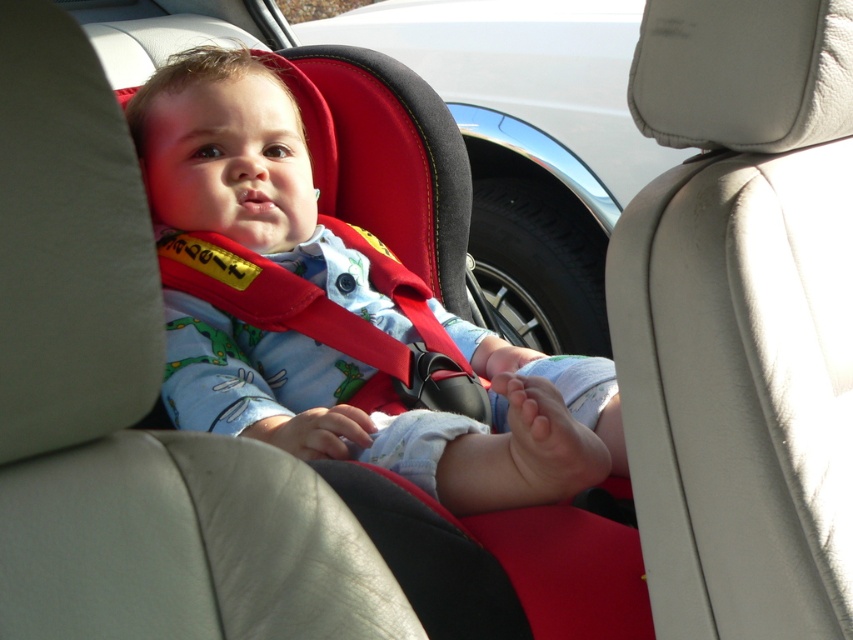
Question: Does matte red car seat at center have a greater width compared to matte black car seat at upper center?

Choices:
 (A) yes
 (B) no

Answer: (B)

Question: Can you confirm if matte red car seat at center is positioned below matte black car seat at upper center?

Choices:
 (A) yes
 (B) no

Answer: (A)

Question: Which object is closer to the camera taking this photo?

Choices:
 (A) matte black car seat at upper center
 (B) matte red car seat at center

Answer: (B)

Question: Is matte red car seat at center to the right of matte black car seat at upper center from the viewer's perspective?

Choices:
 (A) yes
 (B) no

Answer: (B)

Question: Which of the following is the closest to the observer?

Choices:
 (A) matte red car seat at center
 (B) matte black car seat at upper center

Answer: (A)